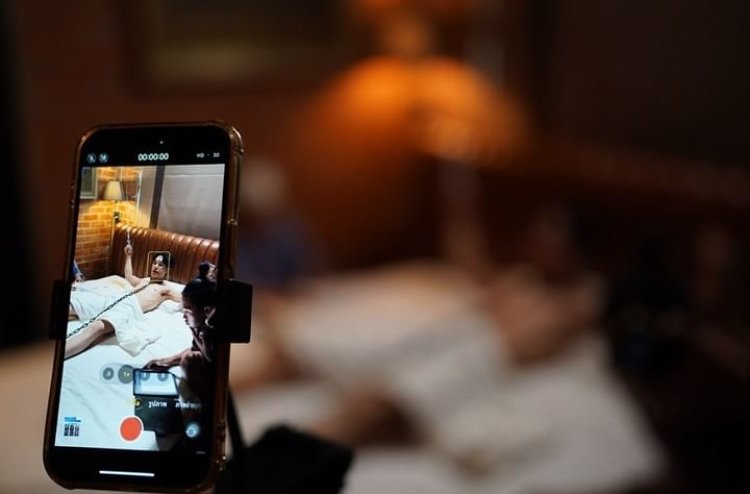
This screenshot has height=494, width=750. What are the coordinates of `wall light` in the screenshot? It's located at (110, 194), (412, 22).